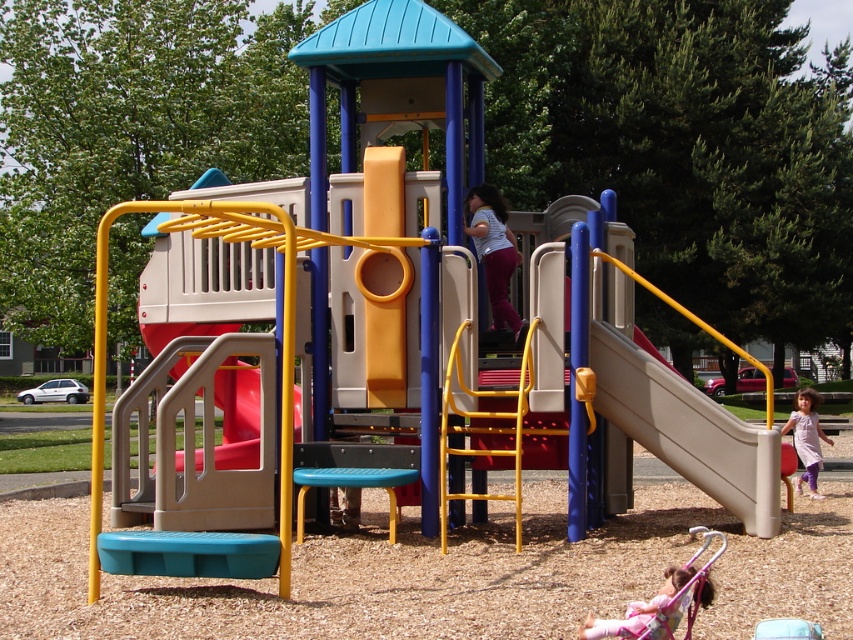
Can you confirm if pastel pink fabric at lower right is bigger than light purple fabric dress at lower right?

Yes, pastel pink fabric at lower right is bigger than light purple fabric dress at lower right.

Where is `pastel pink fabric at lower right`? pastel pink fabric at lower right is located at coordinates 654,609.

Where is `pastel pink fabric at lower right`? Image resolution: width=853 pixels, height=640 pixels. pastel pink fabric at lower right is located at coordinates (654, 609).

Which is below, matte purple pants at center or pastel pink fabric at lower right?

pastel pink fabric at lower right is lower down.

Can you confirm if matte purple pants at center is smaller than pastel pink fabric at lower right?

Incorrect, matte purple pants at center is not smaller in size than pastel pink fabric at lower right.

Between point (495, 262) and point (589, 632), which one is positioned behind?

The point (495, 262) is more distant.

Identify the location of matte purple pants at center. (494, 253).

Which is behind, point (653, 387) or point (682, 580)?

Point (653, 387)

How much distance is there between beige plastic slide at right and pastel pink fabric at lower right?

beige plastic slide at right and pastel pink fabric at lower right are 4.09 meters apart from each other.

What do you see at coordinates (688, 429) in the screenshot?
I see `beige plastic slide at right` at bounding box center [688, 429].

Where is `beige plastic slide at right`? Image resolution: width=853 pixels, height=640 pixels. beige plastic slide at right is located at coordinates pyautogui.click(x=688, y=429).